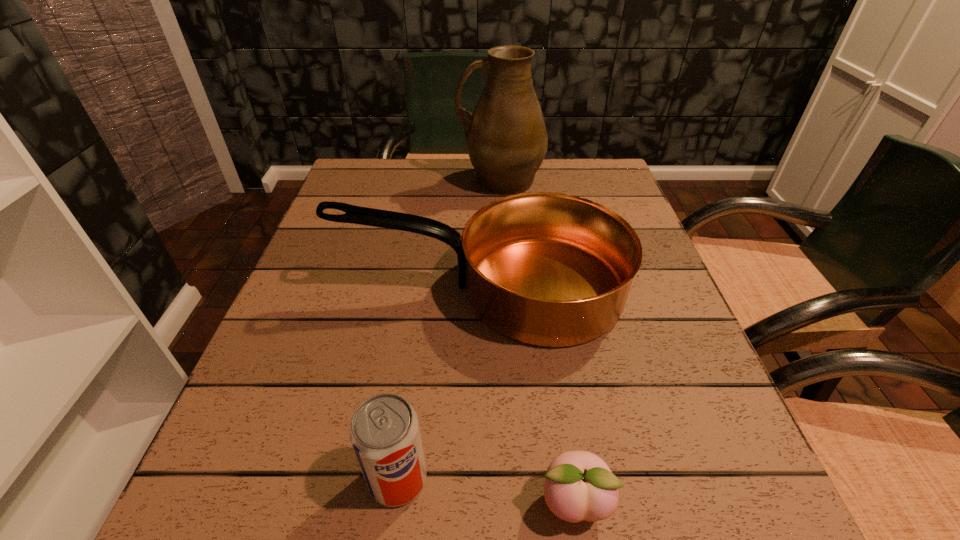
At what (x,y) coordinates should I click in order to perform the action: click on blank space at the right edge of the desktop. Please return your answer as a coordinate pair (x, y). Looking at the image, I should click on (681, 336).

This screenshot has width=960, height=540. Identify the location of free space at the far left corner of the desktop. (367, 172).

In the image, there is a desktop. Identify the location of free region at the far right corner. The image size is (960, 540). (579, 192).

Identify the location of vacant space at the near right corner of the desktop. Image resolution: width=960 pixels, height=540 pixels. (657, 524).

Identify the location of free spot between the peach and the soda. (486, 490).

Where is `free spot between the shortest object and the second tallest object`? free spot between the shortest object and the second tallest object is located at coordinates (528, 395).

Locate an element on the screen. The height and width of the screenshot is (540, 960). blank region between the frying pan and the second shortest object is located at coordinates (441, 383).

Where is `free area in between the shortest object and the second shortest object`? The image size is (960, 540). free area in between the shortest object and the second shortest object is located at coordinates (486, 490).

You are a GUI agent. You are given a task and a screenshot of the screen. Output one action in this format:
    pyautogui.click(x=<x>, y=<y>)
    Task: Click on the unoccupied area between the second farthest object and the second shortest object
    
    Given the screenshot: What is the action you would take?
    pyautogui.click(x=441, y=383)

Image resolution: width=960 pixels, height=540 pixels. In order to click on vacant space in between the pitcher and the soda in this screenshot , I will do `click(449, 330)`.